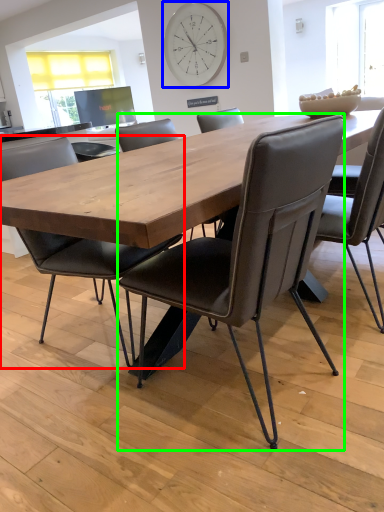
Question: Estimate the real-world distances between objects in this image. Which object is farther from chair (highlighted by a red box), clock (highlighted by a blue box) or chair (highlighted by a green box)?

Choices:
 (A) clock
 (B) chair

Answer: (A)